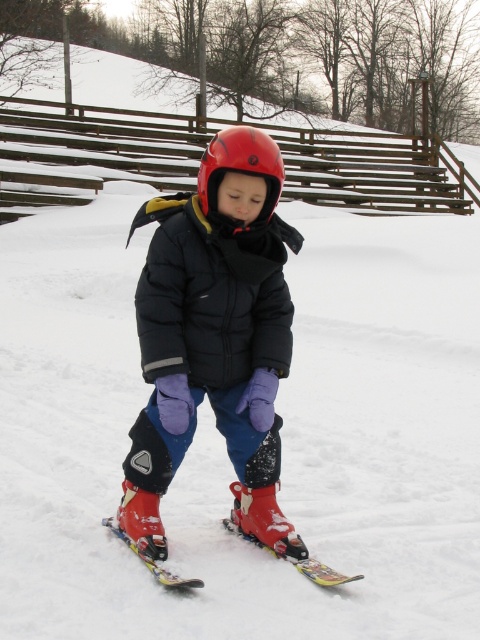
Who is lower down, shiny red helmet at center or yellow plastic ski at center?

yellow plastic ski at center is lower down.

Does point (249, 225) lie behind point (300, 568)?

No, (249, 225) is in front of (300, 568).

Image resolution: width=480 pixels, height=640 pixels. Describe the element at coordinates (240, 172) in the screenshot. I see `shiny red helmet at center` at that location.

The width and height of the screenshot is (480, 640). I want to click on shiny red helmet at center, so click(x=240, y=172).

Between black puffy jacket at center and red matte ski at lower center, which one has more height?

black puffy jacket at center is taller.

Which is behind, point (225, 266) or point (175, 580)?

Positioned behind is point (225, 266).

Who is more forward, (204, 364) or (167, 572)?

Point (167, 572) is more forward.

This screenshot has width=480, height=640. Find the location of `black puffy jacket at center`. black puffy jacket at center is located at coordinates (212, 296).

Can you confirm if black puffy jacket at center is positioned to the right of shiny red helmet at center?

Incorrect, black puffy jacket at center is not on the right side of shiny red helmet at center.

Looking at this image, between black puffy jacket at center and shiny red helmet at center, which one appears on the left side from the viewer's perspective?

black puffy jacket at center

Consider the image. Measure the distance between point (201,365) and camera.

Point (201,365) and camera are 3.16 meters apart.

Where is `black puffy jacket at center`? The image size is (480, 640). black puffy jacket at center is located at coordinates (212, 296).